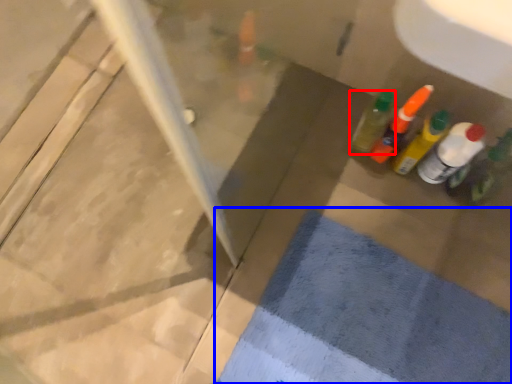
Question: Which object appears farthest to the camera in this image, bottle (highlighted by a red box) or bath mat (highlighted by a blue box)?

Choices:
 (A) bottle
 (B) bath mat

Answer: (A)